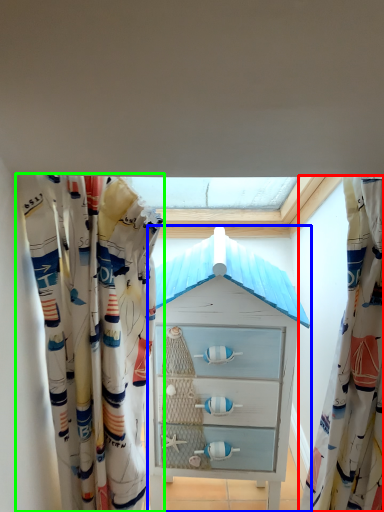
Question: Based on their relative distances, which object is farther from curtain (highlighted by a red box)? Choose from chest of drawers (highlighted by a blue box) and curtain (highlighted by a green box).

Choices:
 (A) chest of drawers
 (B) curtain

Answer: (B)